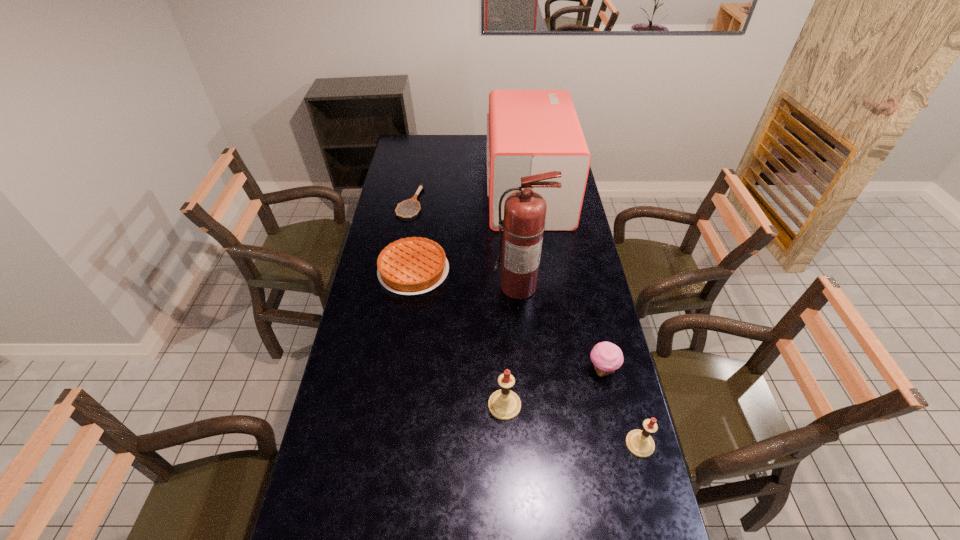
This screenshot has height=540, width=960. Identify the location of vacant space that is in between the cupcake and the pie. (508, 320).

At what (x,y) coordinates should I click in order to perform the action: click on vacant area between the shortest object and the sixth shortest object. Please return your answer as a coordinate pair (x, y). Looking at the image, I should click on (469, 198).

The height and width of the screenshot is (540, 960). I want to click on empty location between the cupcake and the box, so click(x=565, y=281).

Where is `free space that is in between the taller candle and the tallest object`? This screenshot has width=960, height=540. free space that is in between the taller candle and the tallest object is located at coordinates (x=512, y=346).

Find the location of a particular element. This screenshot has width=960, height=540. vacant space in between the sixth farthest object and the fourth shortest object is located at coordinates (572, 424).

Locate an element on the screen. free space between the taller candle and the shortest object is located at coordinates (457, 304).

This screenshot has width=960, height=540. Find the location of `vacant space that is in between the third tallest object and the tennis racket`. vacant space that is in between the third tallest object and the tennis racket is located at coordinates (457, 304).

Identify the location of object that is the sixth closest to the nearest object. This screenshot has height=540, width=960. (421, 186).

Identify the location of object that stands as the closest to the farther candle. (607, 357).

Locate an element on the screen. The image size is (960, 540). vacant region that satisfies the following two spatial constraints: 1. on the back side of the shorter candle; 2. on the surface of the box where the text is embossed is located at coordinates (576, 193).